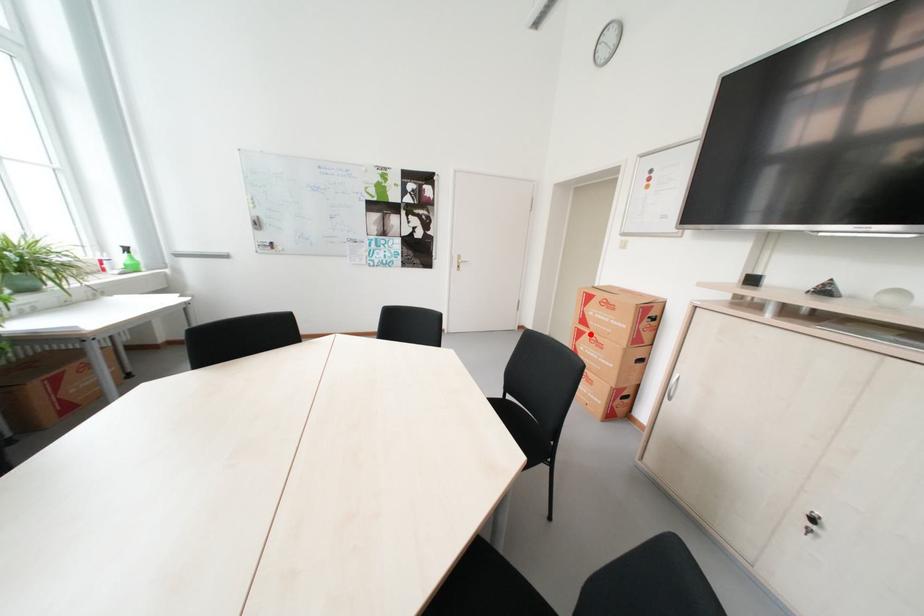
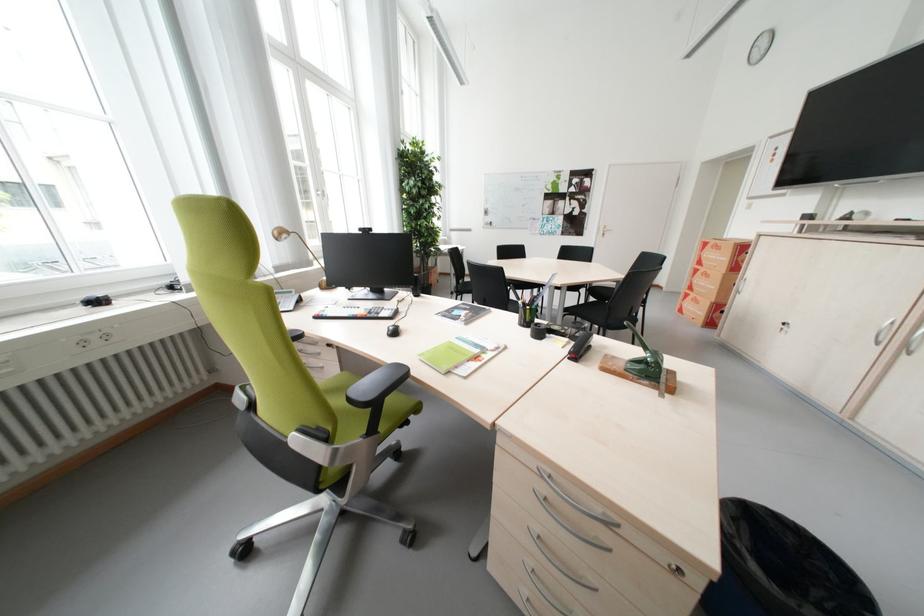
Locate, in the second image, the point that corresponds to the highlighted location in the first image.

(706, 272)